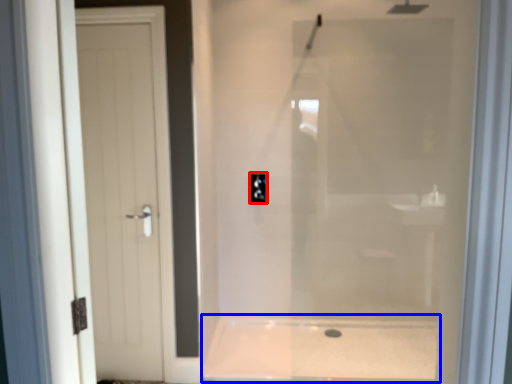
Question: Which object is closer to the camera taking this photo, electric outlet (highlighted by a red box) or bath (highlighted by a blue box)?

Choices:
 (A) electric outlet
 (B) bath

Answer: (B)